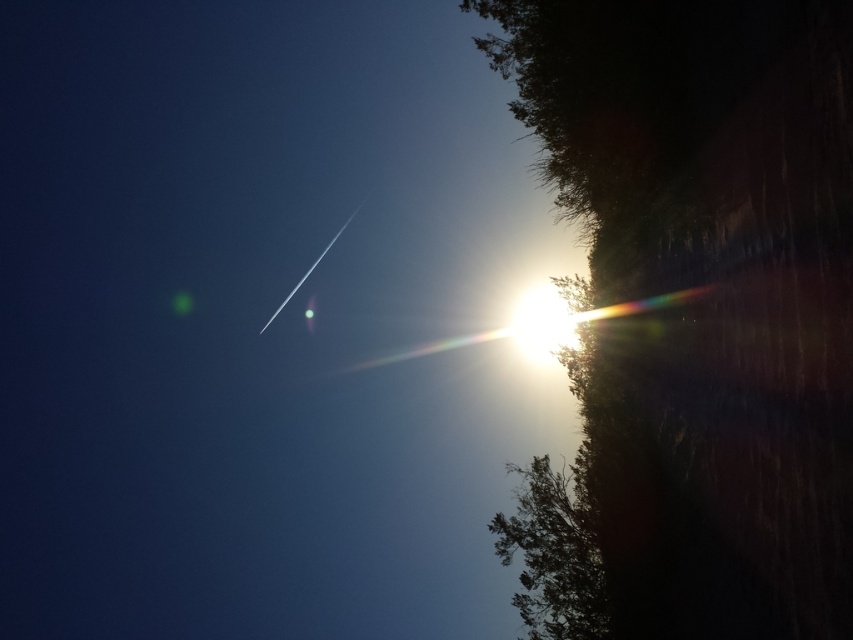
Question: Which point is farther to the camera?

Choices:
 (A) green leafy tree at lower right
 (B) silhouette leafy tree at right

Answer: (A)

Question: Which object appears farthest from the camera in this image?

Choices:
 (A) silhouette leafy tree at right
 (B) green leafy tree at lower right

Answer: (B)

Question: Does silhouette leafy tree at right have a smaller size compared to green leafy tree at lower right?

Choices:
 (A) yes
 (B) no

Answer: (B)

Question: Is the position of silhouette leafy tree at right less distant than that of green leafy tree at lower right?

Choices:
 (A) yes
 (B) no

Answer: (A)

Question: Is silhouette leafy tree at right thinner than green leafy tree at lower right?

Choices:
 (A) no
 (B) yes

Answer: (A)

Question: Which of the following is the farthest from the observer?

Choices:
 (A) silhouette leafy tree at right
 (B) green leafy tree at lower right

Answer: (B)